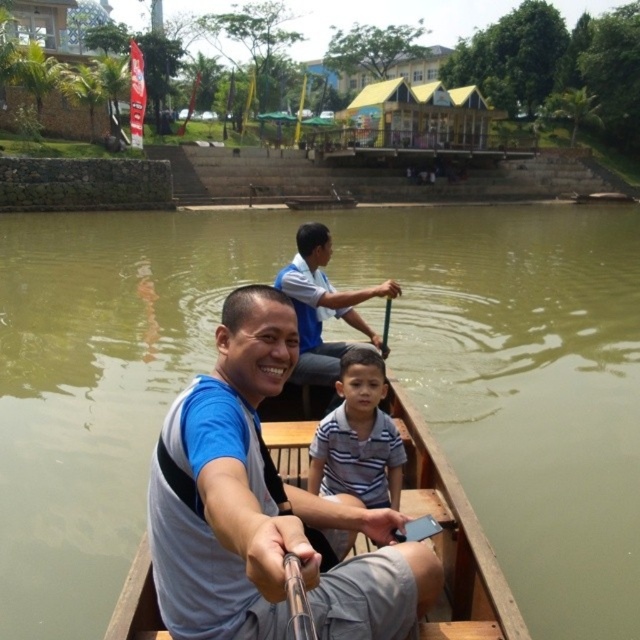
Is gray fabric shirt at center in front of blue fabric shirt at center?

Yes, it is in front of blue fabric shirt at center.

Does gray fabric shirt at center have a lesser width compared to blue fabric shirt at center?

In fact, gray fabric shirt at center might be wider than blue fabric shirt at center.

This screenshot has height=640, width=640. Identify the location of gray fabric shirt at center. (266, 509).

The image size is (640, 640). Describe the element at coordinates (358, 436) in the screenshot. I see `striped cotton shirt at center` at that location.

Find the location of a particular element. The width and height of the screenshot is (640, 640). striped cotton shirt at center is located at coordinates (358, 436).

The width and height of the screenshot is (640, 640). What do you see at coordinates (358, 436) in the screenshot?
I see `striped cotton shirt at center` at bounding box center [358, 436].

This screenshot has height=640, width=640. I want to click on striped cotton shirt at center, so click(x=358, y=436).

Who is lower down, greenish-brown wood boat at center or striped cotton shirt at center?

Positioned lower is striped cotton shirt at center.

Does point (500, 403) come behind point (342, 435)?

Yes.

Which is in front, point (168, 332) or point (356, 417)?

Point (356, 417)

Image resolution: width=640 pixels, height=640 pixels. Find the location of `greenish-brown wood boat at center`. greenish-brown wood boat at center is located at coordinates pyautogui.click(x=388, y=372).